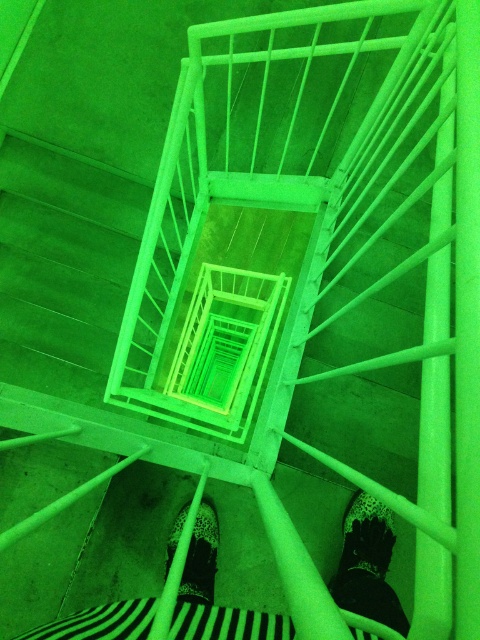
Can you confirm if black matte/leather shoe at lower center is positioned to the left of leopard print shoe at center?

In fact, black matte/leather shoe at lower center is to the right of leopard print shoe at center.

Does black matte/leather shoe at lower center have a greater width compared to leopard print shoe at center?

Yes, black matte/leather shoe at lower center is wider than leopard print shoe at center.

The image size is (480, 640). I want to click on black matte/leather shoe at lower center, so click(367, 536).

Does striped fabric pants at center appear on the right side of leopard print shoe at center?

Correct, you'll find striped fabric pants at center to the right of leopard print shoe at center.

Does striped fabric pants at center have a larger size compared to leopard print shoe at center?

Correct, striped fabric pants at center is larger in size than leopard print shoe at center.

What do you see at coordinates (368, 564) in the screenshot?
I see `striped fabric pants at center` at bounding box center [368, 564].

Find the location of a particular element. This screenshot has width=480, height=640. striped fabric pants at center is located at coordinates (368, 564).

Is point (186, 588) positioned behind point (362, 508)?

No, (186, 588) is closer to viewer.

Is striped fabric pants at center positioned before black matte/leather shoe at lower center?

Yes, striped fabric pants at center is in front of black matte/leather shoe at lower center.

Locate an element on the screen. This screenshot has height=640, width=480. striped fabric pants at center is located at coordinates (368, 564).